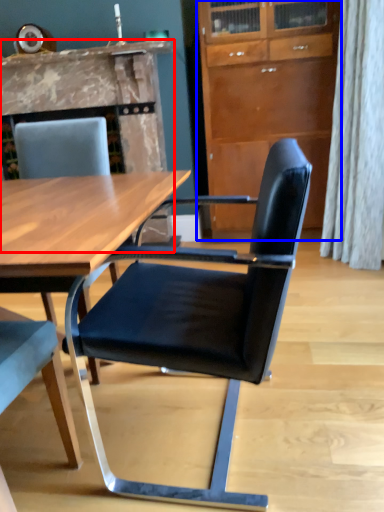
Question: Which of the following is the closest to the observer, fireplace (highlighted by a red box) or cabinetry (highlighted by a blue box)?

Choices:
 (A) fireplace
 (B) cabinetry

Answer: (B)